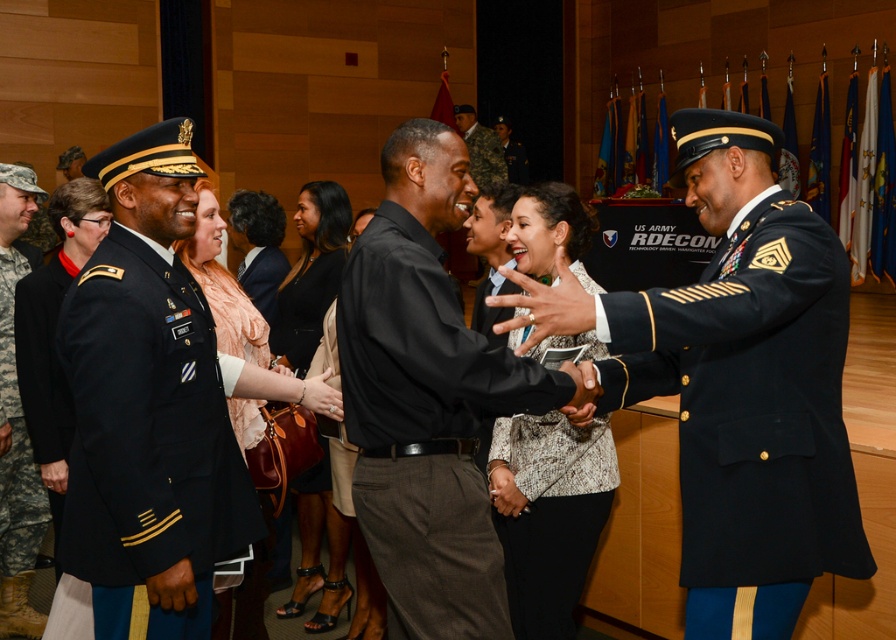
You are a photographer at the event and need to capture a clear photo of both the matte peach dress at center and the satin beige dress at center. Which dress should you focus on first to ensure it appears in the foreground of the photo?

The matte peach dress at center is in front of the satin beige dress at center, so you should focus on the matte peach dress at center first to ensure it appears in the foreground.

You are a photographer at this event and need to capture a photo of the navy blue wool military uniform at left and the patterned fabric blouse at center. Based on their positions, which one is higher up in the frame?

The navy blue wool military uniform at left is located above the patterned fabric blouse at center, so it will appear higher up in the frame.